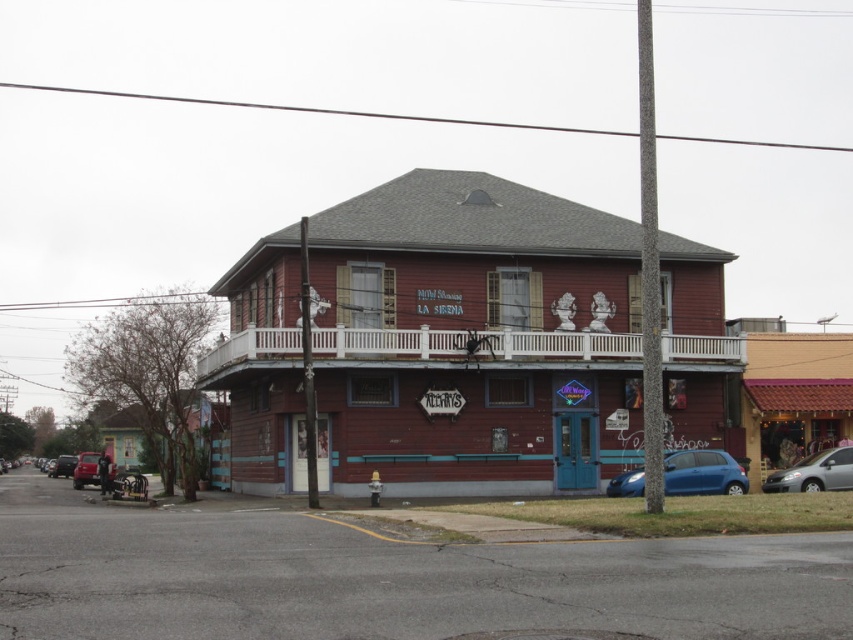
You are a delivery driver approaching the building and need to park your vehicle. You see a matte blue car at lower right and a silver metallic van at lower right. Which vehicle is parked closer to the entrance of the building?

The matte blue car at lower right is closer to the viewer than the silver metallic van at lower right, so the matte blue car at lower right is parked closer to the entrance of the building.

You are a delivery driver who needs to park your vehicle between the silver metallic van at lower right and the metallic red car at lower left. Is there enough space for your vehicle which is 5 meters long?

A: The silver metallic van at lower right is positioned on the right side of metallic red car at lower left. The distance between them is not specified, so it is uncertain if there is enough space for a 5 meter long vehicle. Check the actual distance before deciding.

You are a delivery person arriving at this building to drop off a package. You see a silver metallic van at lower right and a metallic red car at lower left. Which vehicle should you park behind to avoid blocking the other?

You should park behind the silver metallic van at lower right because it is already positioned over the metallic red car at lower left, so placing your vehicle behind it would maintain the existing order without obstructing the car.